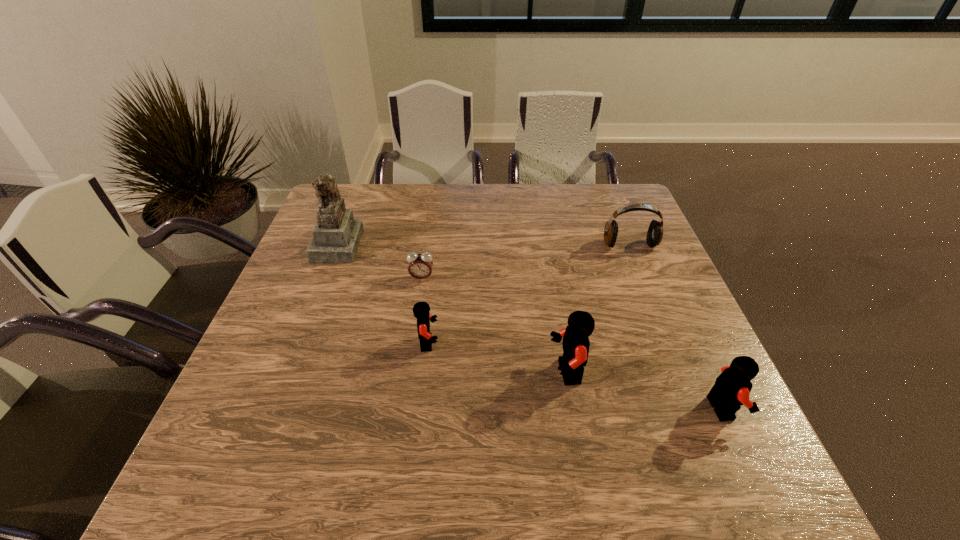
Where is `the shortest Lego`? The height and width of the screenshot is (540, 960). the shortest Lego is located at coordinates [x=421, y=310].

This screenshot has width=960, height=540. Find the location of `the third object from right to left`. the third object from right to left is located at coordinates tap(581, 324).

Image resolution: width=960 pixels, height=540 pixels. In order to click on the rightmost Lego in this screenshot , I will do `click(732, 388)`.

Locate an element on the screen. This screenshot has height=540, width=960. alarm clock is located at coordinates (420, 265).

The height and width of the screenshot is (540, 960). What are the coordinates of `the third farthest object` in the screenshot? It's located at (420, 265).

I want to click on the tallest object, so click(x=336, y=236).

Locate an element on the screen. The image size is (960, 540). the leftmost object is located at coordinates (336, 236).

Locate an element on the screen. headset is located at coordinates (654, 236).

The width and height of the screenshot is (960, 540). Identify the location of free space located 0.150m on the front-facing side of the leftmost Lego. (506, 343).

Where is `vacant region located on the front-facing side of the second Lego from left to right`? vacant region located on the front-facing side of the second Lego from left to right is located at coordinates (484, 373).